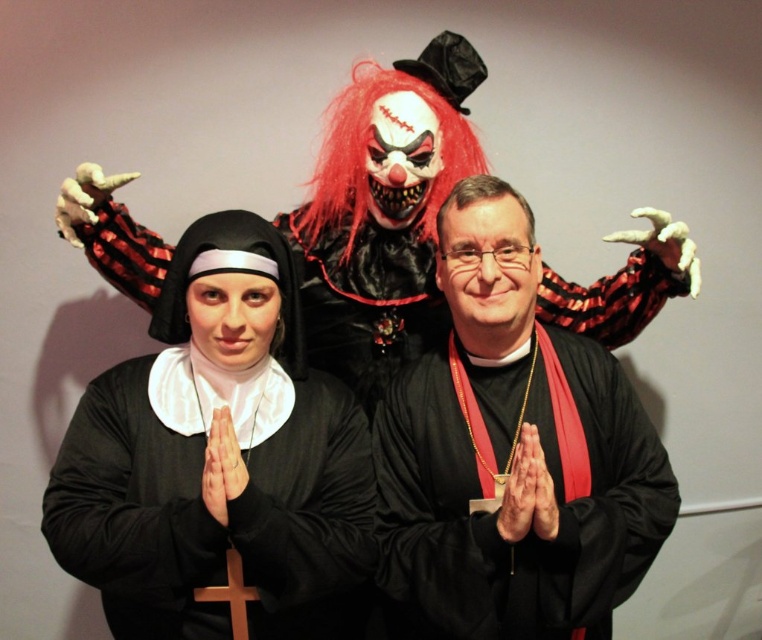
Question: Can you confirm if black matte nun at center is thinner than red synthetic wig at center?

Choices:
 (A) no
 (B) yes

Answer: (A)

Question: Among these objects, which one is farthest from the camera?

Choices:
 (A) red synthetic wig at center
 (B) black matte nun at center
 (C) black matte priest at center

Answer: (A)

Question: Does black matte priest at center appear on the right side of red synthetic wig at center?

Choices:
 (A) yes
 (B) no

Answer: (A)

Question: Which of the following is the closest to the observer?

Choices:
 (A) (572, 598)
 (B) (165, 289)

Answer: (A)

Question: Is black matte priest at center positioned before red synthetic wig at center?

Choices:
 (A) yes
 (B) no

Answer: (A)

Question: Which point is closer to the camera?

Choices:
 (A) black matte nun at center
 (B) black matte priest at center

Answer: (B)